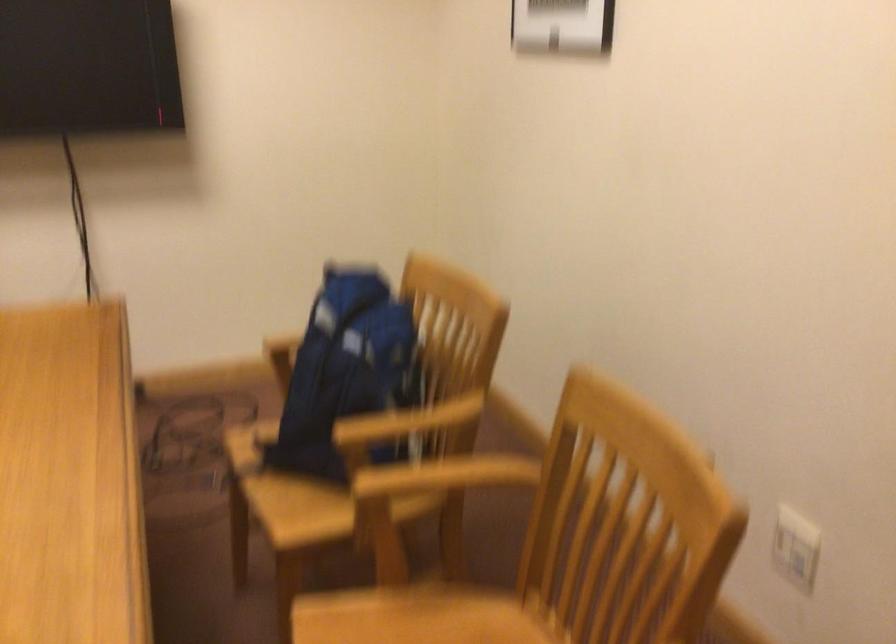
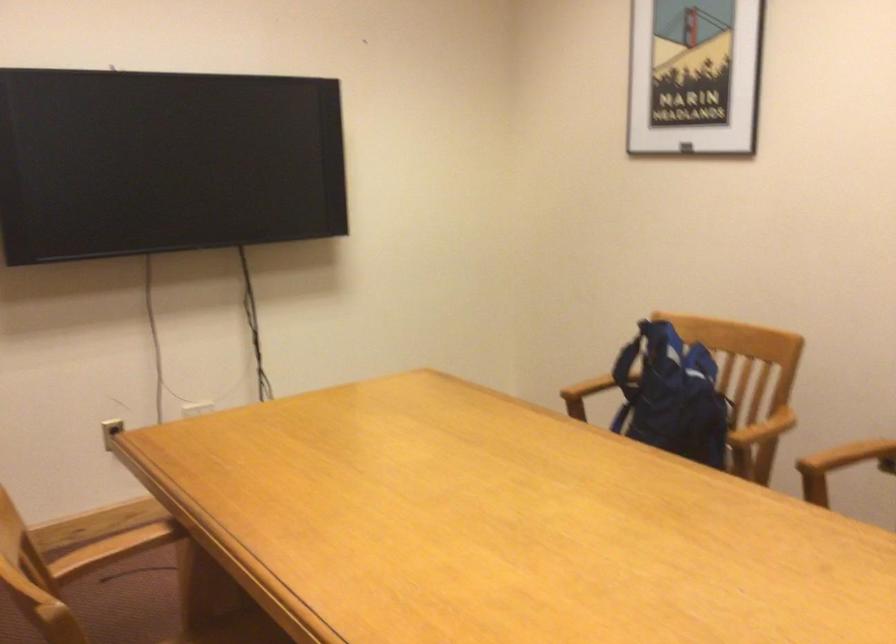
In the second image, find the point that corresponds to (424,422) in the first image.

(763, 428)